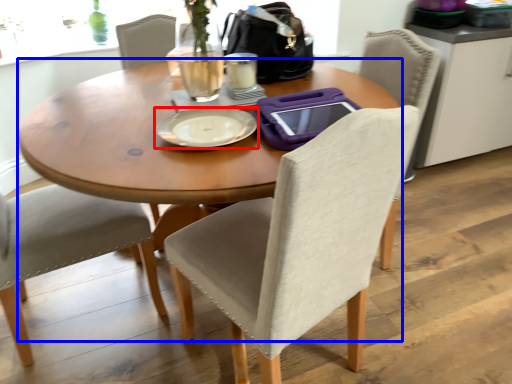
Question: Among these objects, which one is nearest to the camera, plate (highlighted by a red box) or kitchen & dining room table (highlighted by a blue box)?

Choices:
 (A) plate
 (B) kitchen & dining room table

Answer: (B)